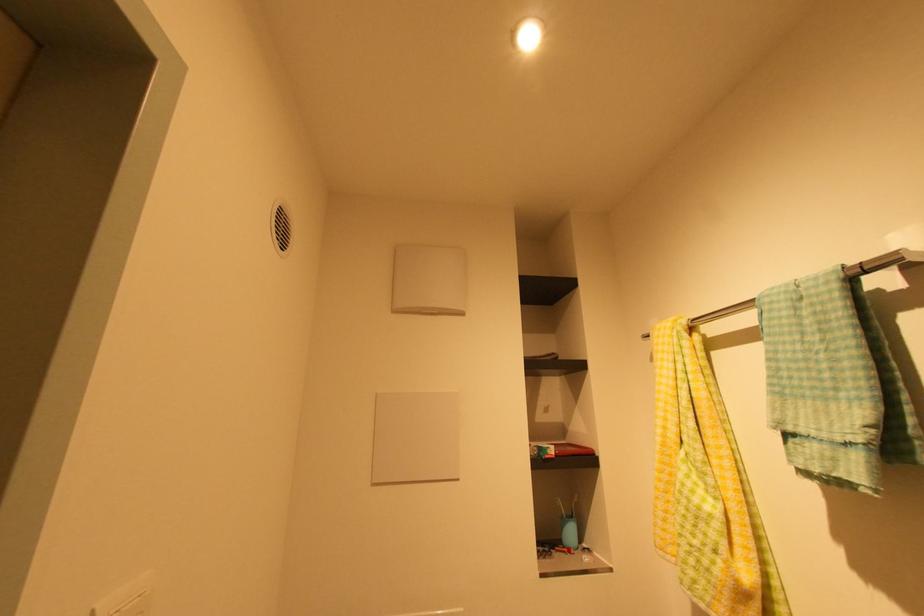
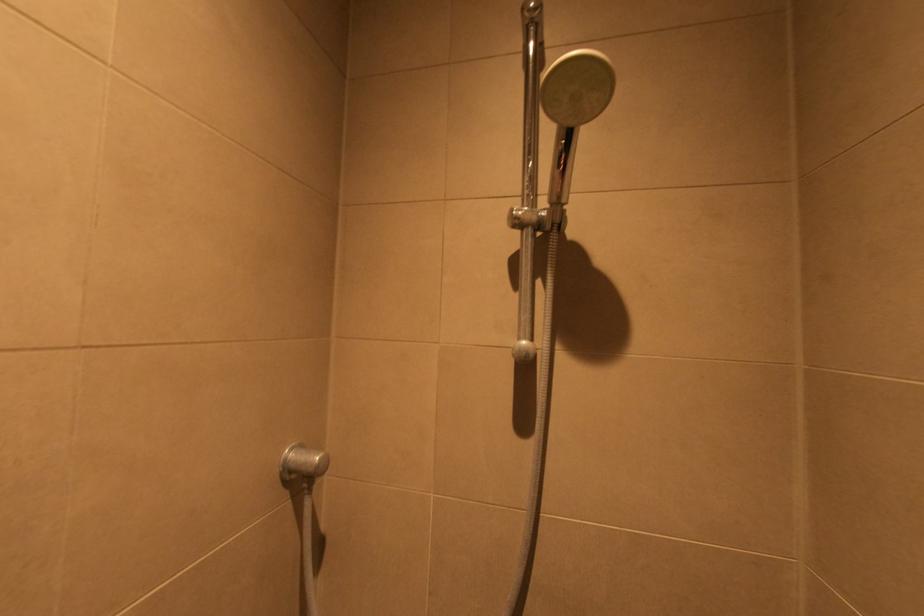
Question: The camera is either moving clockwise (left) or counter-clockwise (right) around the object. The first image is from the beginning of the video and the second image is from the end. Is the camera moving left or right when shooting the video?

Choices:
 (A) Left
 (B) Right

Answer: (A)